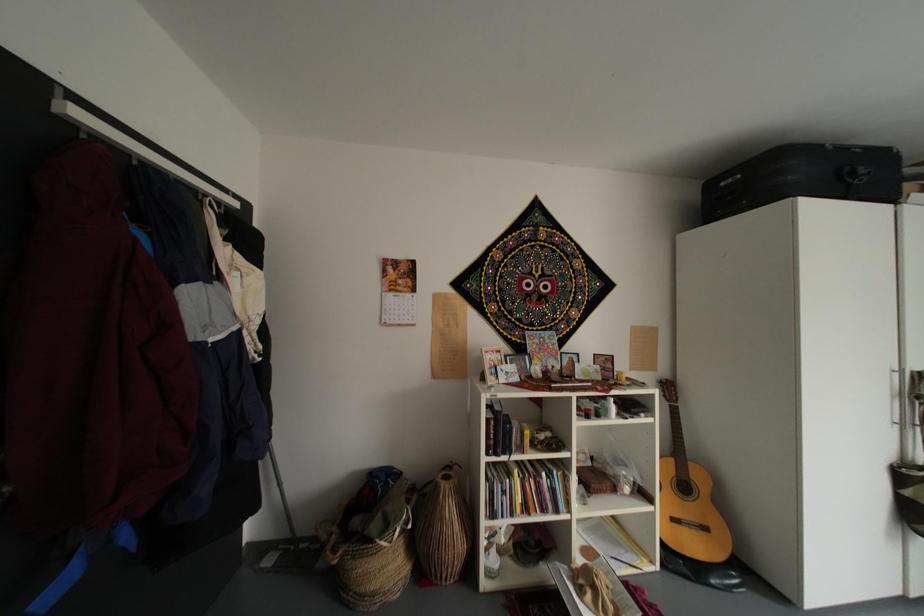
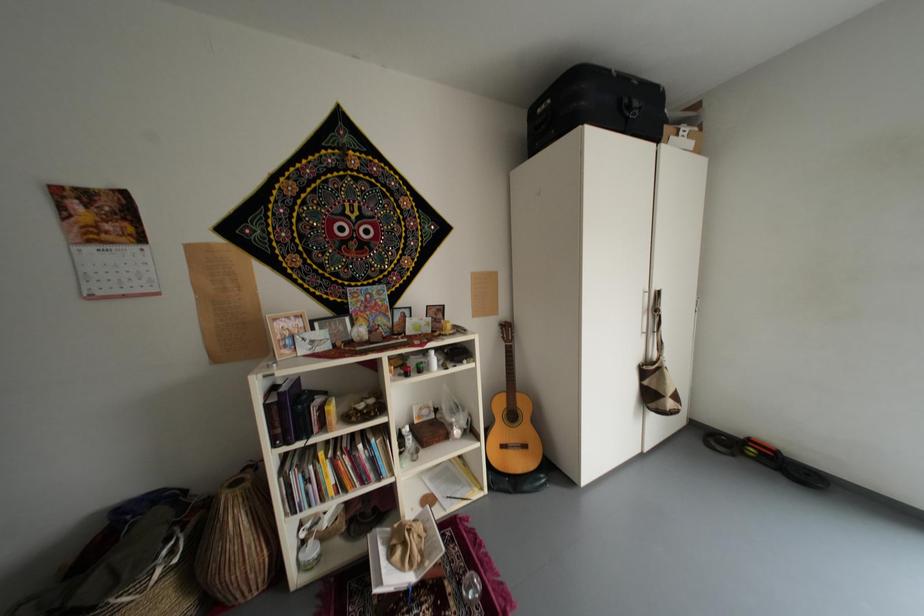
Question: The first image is from the beginning of the video and the second image is from the end. How did the camera likely rotate when shooting the video?

Choices:
 (A) Left
 (B) Right
 (C) Up
 (D) Down

Answer: (B)